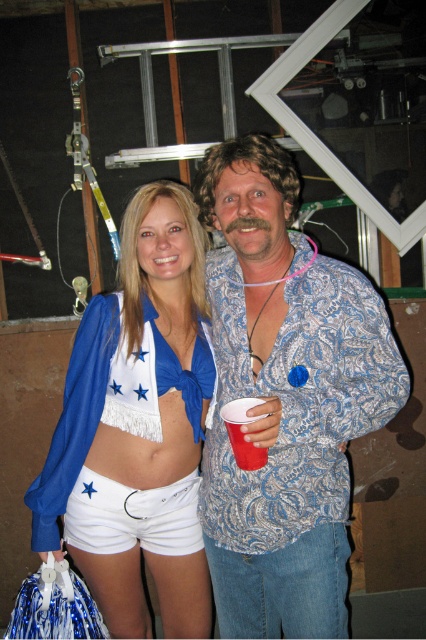
Is paisley-patterned shirt at center taller than blue fringed bikini top at center?

Yes, paisley-patterned shirt at center is taller than blue fringed bikini top at center.

This screenshot has width=426, height=640. In order to click on paisley-patterned shirt at center in this screenshot , I will do `click(285, 397)`.

Does white cotton shorts at center appear on the right side of red plastic cup at center?

In fact, white cotton shorts at center is to the left of red plastic cup at center.

Where is `white cotton shorts at center`? white cotton shorts at center is located at coordinates 132,516.

Between white cotton shorts at center and blue fringed bikini top at center, which one appears on the left side from the viewer's perspective?

white cotton shorts at center is more to the left.

Between point (178, 536) and point (201, 385), which one is positioned behind?

The point (178, 536) is more distant.

Is point (100, 476) closer to camera compared to point (195, 374)?

No, (100, 476) is further to viewer.

I want to click on white cotton shorts at center, so click(132, 516).